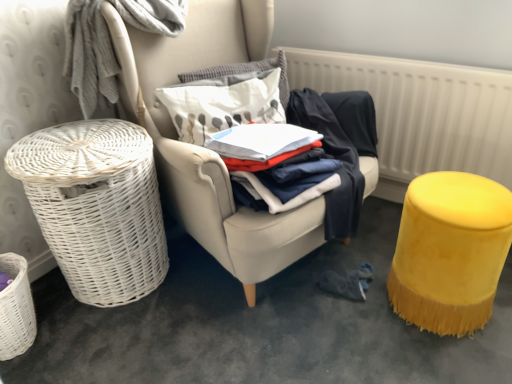
The width and height of the screenshot is (512, 384). What are the coordinates of `free space that is in between white wicker basket at left and yellow velvet stool at right` in the screenshot? It's located at (362, 333).